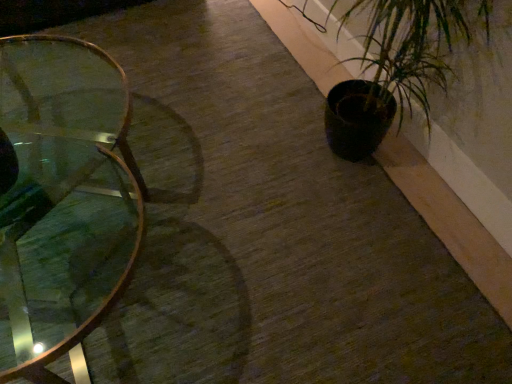
Where is `vacant point to the right of clear glass table at left`? The height and width of the screenshot is (384, 512). vacant point to the right of clear glass table at left is located at coordinates (289, 247).